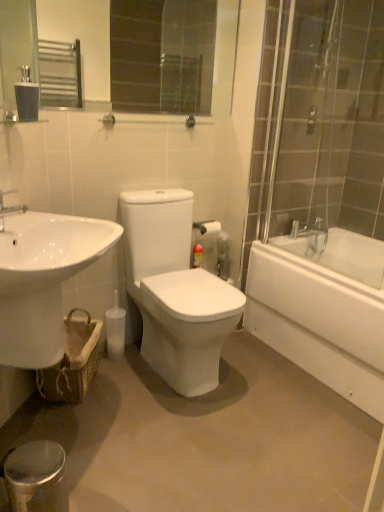
Question: From the image's perspective, is silver metallic faucet at upper left on top of white glossy sink at lower left?

Choices:
 (A) yes
 (B) no

Answer: (A)

Question: Does silver metallic faucet at upper left have a greater width compared to white glossy sink at lower left?

Choices:
 (A) yes
 (B) no

Answer: (B)

Question: Can you confirm if silver metallic faucet at upper left is bigger than white glossy sink at lower left?

Choices:
 (A) yes
 (B) no

Answer: (B)

Question: Can you confirm if silver metallic faucet at upper left is smaller than white glossy sink at lower left?

Choices:
 (A) no
 (B) yes

Answer: (B)

Question: From a real-world perspective, does silver metallic faucet at upper left stand above white glossy sink at lower left?

Choices:
 (A) yes
 (B) no

Answer: (A)

Question: In terms of size, does glossy glass mirror at upper center appear bigger or smaller than matte black tissue at upper left?

Choices:
 (A) big
 (B) small

Answer: (A)

Question: In terms of height, does glossy glass mirror at upper center look taller or shorter compared to matte black tissue at upper left?

Choices:
 (A) short
 (B) tall

Answer: (B)

Question: Is point (129, 19) positioned closer to the camera than point (21, 72)?

Choices:
 (A) closer
 (B) farther

Answer: (B)

Question: Is glossy glass mirror at upper center wider or thinner than matte black tissue at upper left?

Choices:
 (A) wide
 (B) thin

Answer: (B)

Question: From the image's perspective, is white glossy bathtub at right positioned above or below white glossy sink at lower left?

Choices:
 (A) above
 (B) below

Answer: (B)

Question: From a real-world perspective, is white glossy bathtub at right positioned above or below white glossy sink at lower left?

Choices:
 (A) below
 (B) above

Answer: (A)

Question: Based on their positions, is white glossy bathtub at right located to the left or right of white glossy sink at lower left?

Choices:
 (A) right
 (B) left

Answer: (A)

Question: Considering the positions of white glossy bathtub at right and white glossy sink at lower left in the image, is white glossy bathtub at right taller or shorter than white glossy sink at lower left?

Choices:
 (A) tall
 (B) short

Answer: (A)

Question: In terms of width, does silver metallic faucet at upper left look wider or thinner when compared to glossy glass mirror at upper center?

Choices:
 (A) thin
 (B) wide

Answer: (B)

Question: Would you say silver metallic faucet at upper left is to the left or to the right of glossy glass mirror at upper center in the picture?

Choices:
 (A) right
 (B) left

Answer: (B)